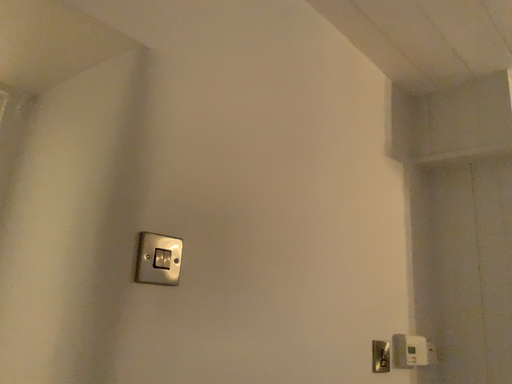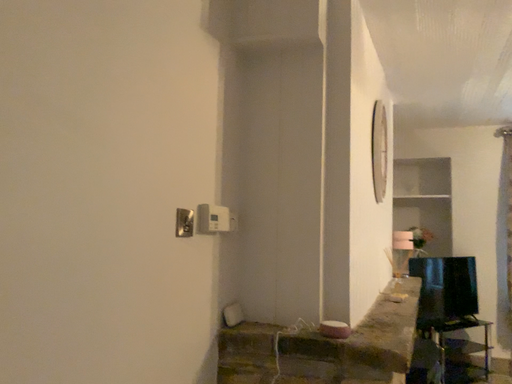
Question: How did the camera likely rotate when shooting the video?

Choices:
 (A) rotated right
 (B) rotated left

Answer: (A)